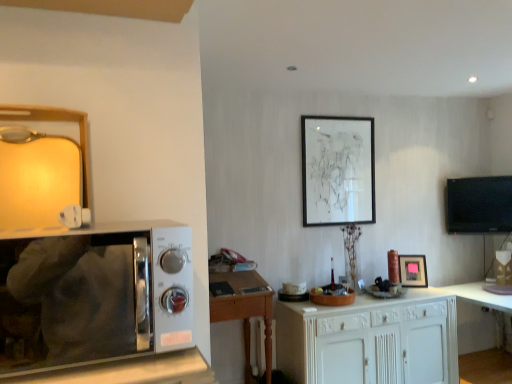
Find the location of a particular element. The height and width of the screenshot is (384, 512). empty space that is ontop of matte black picture frame at upper center, which is counted as the 1th picture frame, starting from the top (from a real-world perspective) is located at coordinates (339, 118).